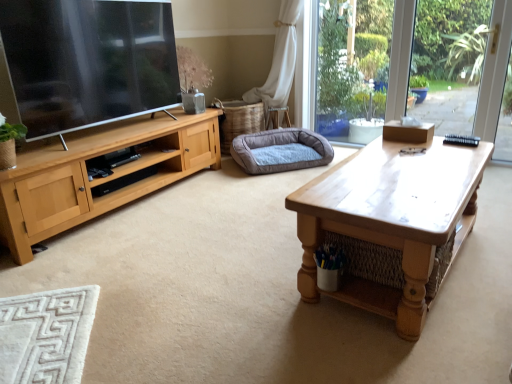
Describe the element at coordinates (391, 224) in the screenshot. The height and width of the screenshot is (384, 512). I see `wooden coffee table at center` at that location.

Where is `wooden coffee table at center`? wooden coffee table at center is located at coordinates (391, 224).

Find the location of a particular element. This screenshot has width=512, height=384. gray fabric dog bed at center is located at coordinates (279, 145).

What is the approximate height of gray fabric dog bed at center?

gray fabric dog bed at center is 9.34 inches in height.

The height and width of the screenshot is (384, 512). Describe the element at coordinates (279, 145) in the screenshot. I see `gray fabric dog bed at center` at that location.

Find the location of a particular element. wooden coffee table at center is located at coordinates (391, 224).

Can you confirm if wooden coffee table at center is positioned to the right of gray fabric dog bed at center?

Yes, wooden coffee table at center is to the right of gray fabric dog bed at center.

Considering the relative positions of wooden coffee table at center and gray fabric dog bed at center in the image provided, is wooden coffee table at center behind gray fabric dog bed at center?

No, the depth of wooden coffee table at center is less than that of gray fabric dog bed at center.

Considering the positions of point (425, 180) and point (271, 138), is point (425, 180) closer or farther from the camera than point (271, 138)?

Point (425, 180) appears to be closer to the viewer than point (271, 138).

From the image's perspective, would you say wooden coffee table at center is shown under gray fabric dog bed at center?

Yes.

From a real-world perspective, between wooden coffee table at center and gray fabric dog bed at center, who is vertically lower?

In real-world perspective, gray fabric dog bed at center is lower.

Can you confirm if wooden coffee table at center is wider than gray fabric dog bed at center?

Indeed, wooden coffee table at center has a greater width compared to gray fabric dog bed at center.

Who is taller, wooden coffee table at center or gray fabric dog bed at center?

With more height is wooden coffee table at center.

Can you confirm if wooden coffee table at center is smaller than gray fabric dog bed at center?

No.

Is wooden coffee table at center not inside gray fabric dog bed at center?

That's correct, wooden coffee table at center is outside of gray fabric dog bed at center.

Is wooden coffee table at center far from gray fabric dog bed at center?

Yes, wooden coffee table at center is far from gray fabric dog bed at center.

Looking at this image, could you tell me if wooden coffee table at center is facing gray fabric dog bed at center?

Yes, wooden coffee table at center is facing gray fabric dog bed at center.

Locate an element on the screen. The image size is (512, 384). coffee table below the gray fabric dog bed at center (from the image's perspective) is located at coordinates (391, 224).

Which is more to the right, gray fabric dog bed at center or wooden coffee table at center?

wooden coffee table at center is more to the right.

Between gray fabric dog bed at center and wooden coffee table at center, which one is positioned in front?

wooden coffee table at center is in front.

Between point (242, 146) and point (366, 285), which one is positioned behind?

Point (242, 146)

From the image's perspective, which is below, gray fabric dog bed at center or wooden coffee table at center?

wooden coffee table at center is shown below in the image.

From a real-world perspective, which object rests below the other?

gray fabric dog bed at center.

Is gray fabric dog bed at center wider or thinner than wooden coffee table at center?

In the image, gray fabric dog bed at center appears to be more narrow than wooden coffee table at center.

Between gray fabric dog bed at center and wooden coffee table at center, which one has more height?

With more height is wooden coffee table at center.

Does gray fabric dog bed at center have a smaller size compared to wooden coffee table at center?

Correct, gray fabric dog bed at center occupies less space than wooden coffee table at center.

Is gray fabric dog bed at center located outside wooden coffee table at center?

Yes, gray fabric dog bed at center is not within wooden coffee table at center.

Is gray fabric dog bed at center not near wooden coffee table at center?

Yes.

Is gray fabric dog bed at center facing away from wooden coffee table at center?

No, gray fabric dog bed at center is not facing the opposite direction of wooden coffee table at center.

What's the angular difference between gray fabric dog bed at center and wooden coffee table at center's facing directions?

The angular difference between gray fabric dog bed at center and wooden coffee table at center is 143 degrees.

This screenshot has height=384, width=512. Identify the location of dog bed below the wooden coffee table at center (from a real-world perspective). (279, 145).

Where is `dog bed located behind the wooden coffee table at center`? dog bed located behind the wooden coffee table at center is located at coordinates (279, 145).

Where is `coffee table above the gray fabric dog bed at center (from a real-world perspective)`? coffee table above the gray fabric dog bed at center (from a real-world perspective) is located at coordinates (391, 224).